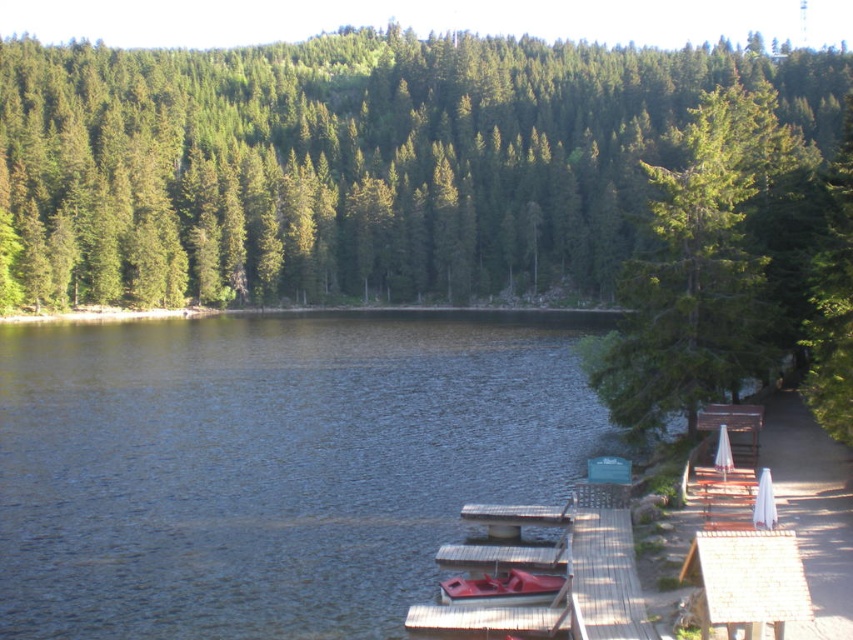
Question: Does blue water at lower left have a greater width compared to white wood picnic table at right?

Choices:
 (A) yes
 (B) no

Answer: (A)

Question: Is the position of blue water at lower left less distant than that of white wood picnic table at right?

Choices:
 (A) no
 (B) yes

Answer: (B)

Question: Which point is closer to the camera?

Choices:
 (A) (508, 582)
 (B) (592, 209)

Answer: (A)

Question: Among these objects, which one is nearest to the camera?

Choices:
 (A) green matte tree at upper right
 (B) white wood picnic table at right
 (C) rubber boat at dock center
 (D) blue water at lower left

Answer: (D)

Question: Estimate the real-world distances between objects in this image. Which object is closer to the rubber boat at dock center?

Choices:
 (A) green matte tree at upper right
 (B) white wood picnic table at right
 (C) green matte tree at center

Answer: (B)

Question: Can you confirm if green matte tree at center is wider than green matte tree at upper right?

Choices:
 (A) no
 (B) yes

Answer: (B)